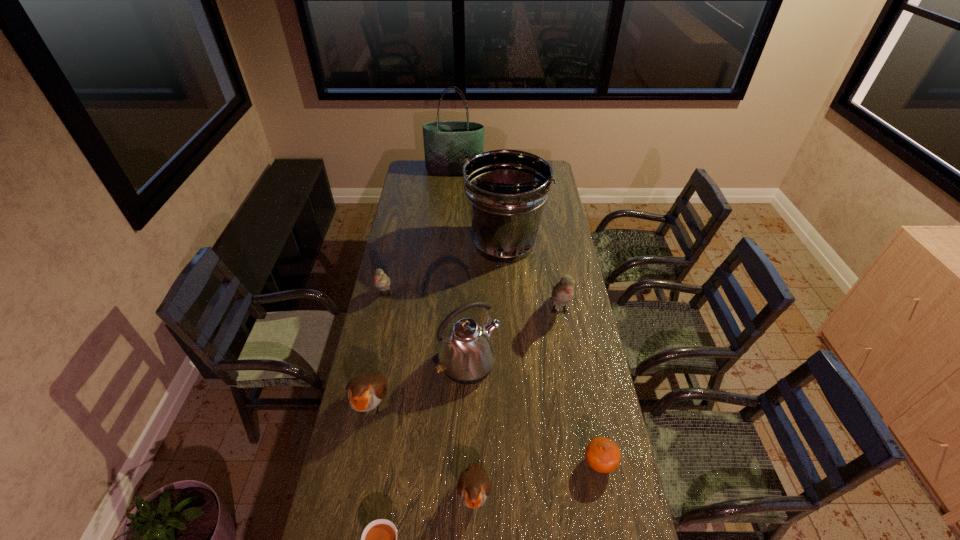
Image resolution: width=960 pixels, height=540 pixels. Find the location of `the smaller brown bird`. the smaller brown bird is located at coordinates (473, 486).

At what (x,y) coordinates should I click in order to perform the action: click on orange. Please return your answer as a coordinate pair (x, y). Looking at the image, I should click on (602, 454).

Find the location of a particular element. This screenshot has height=540, width=960. orange orange is located at coordinates (602, 454).

Where is `vacant space located on the right of the farthest object`? The height and width of the screenshot is (540, 960). vacant space located on the right of the farthest object is located at coordinates (492, 170).

You are a GUI agent. You are given a task and a screenshot of the screen. Output one action in this format:
    pyautogui.click(x=<x>, y=<y>)
    Task: Click on the vacant space located 0.220m on the left of the second farthest object
    The width and height of the screenshot is (960, 540).
    Given the screenshot: What is the action you would take?
    pyautogui.click(x=418, y=244)

Where is `free space located on the right of the seventh shortest object`? free space located on the right of the seventh shortest object is located at coordinates (516, 365).

Where is `vacant space located 0.090m at the face of the rightmost bird`? This screenshot has width=960, height=540. vacant space located 0.090m at the face of the rightmost bird is located at coordinates (566, 349).

The height and width of the screenshot is (540, 960). What are the coordinates of `vacant area situated 0.310m at the face of the farther brown bird` in the screenshot? It's located at (346, 538).

The image size is (960, 540). I want to click on vacant space positioned 0.310m at the face of the smaller white bird, so click(370, 370).

I want to click on vacant region located on the back of the eighth tallest object, so click(x=579, y=357).